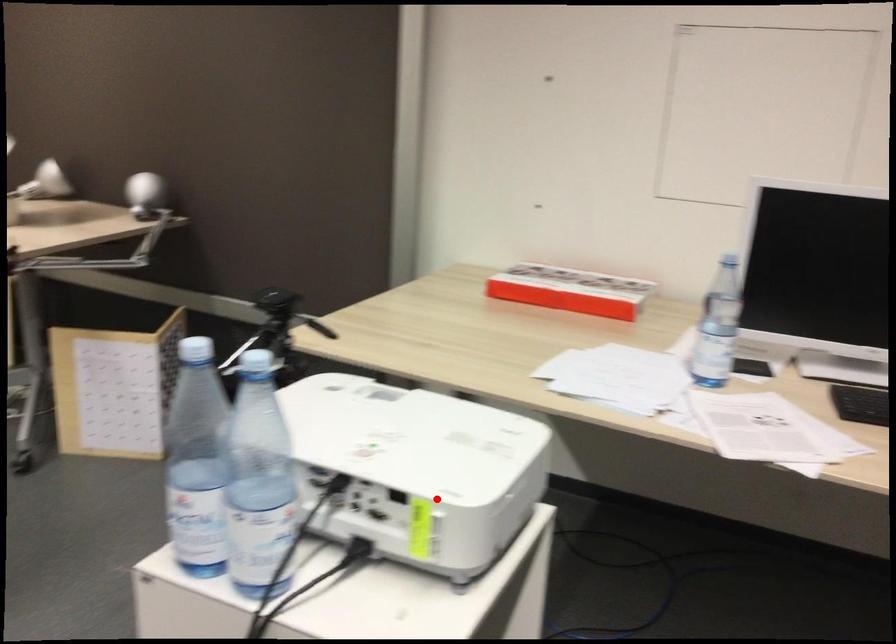
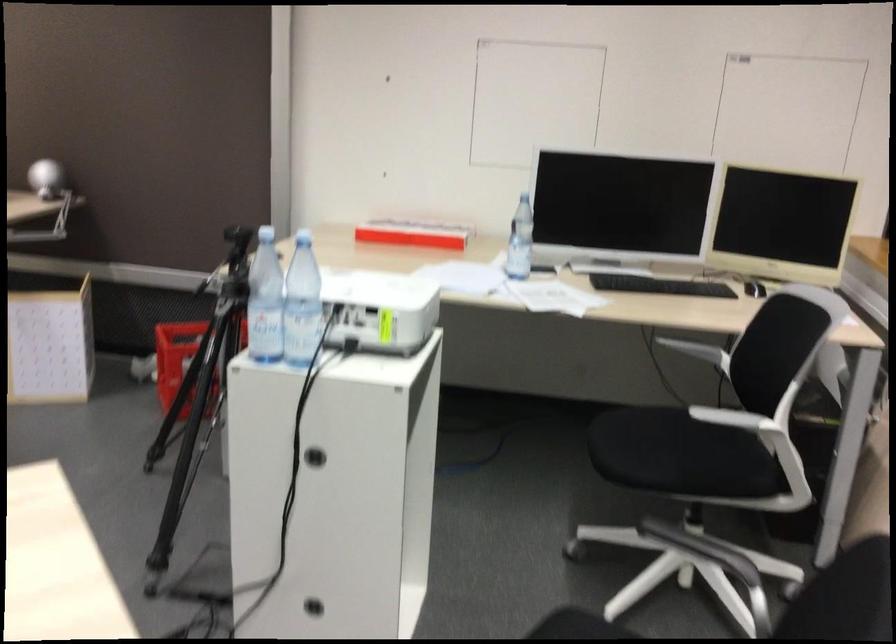
Question: A red point is marked in image1. In image2, is the corresponding 3D point closer to the camera or farther? Reply with the corresponding letter.

Choices:
 (A) The corresponding 3D point is closer.
 (B) The corresponding 3D point is farther.

Answer: (B)